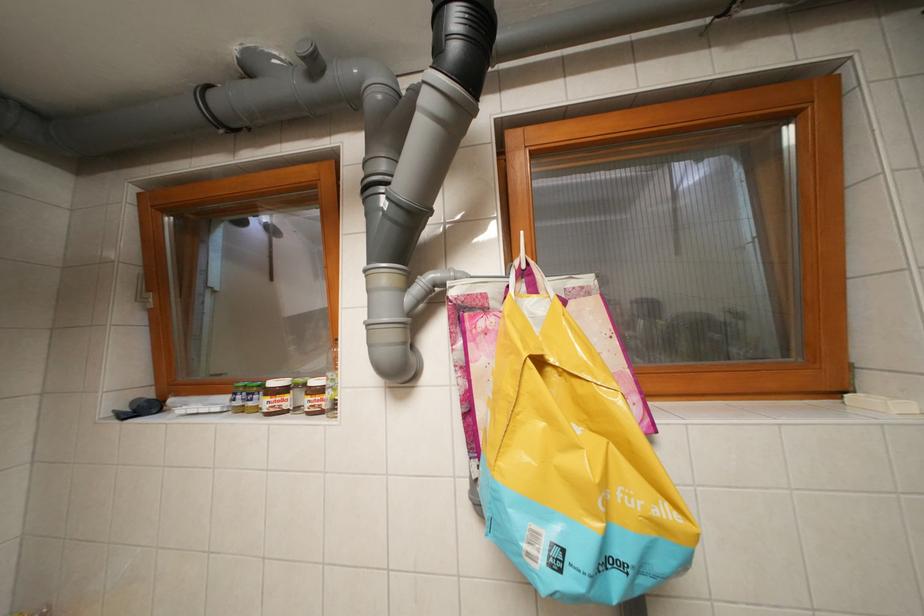
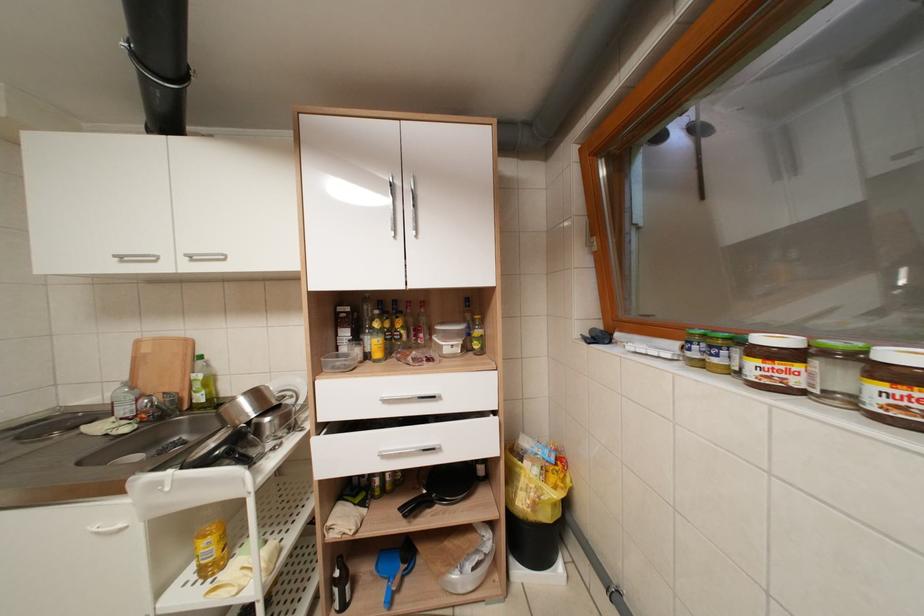
Question: The first image is from the beginning of the video and the second image is from the end. How did the camera likely rotate when shooting the video?

Choices:
 (A) Left
 (B) Right
 (C) Up
 (D) Down

Answer: (A)